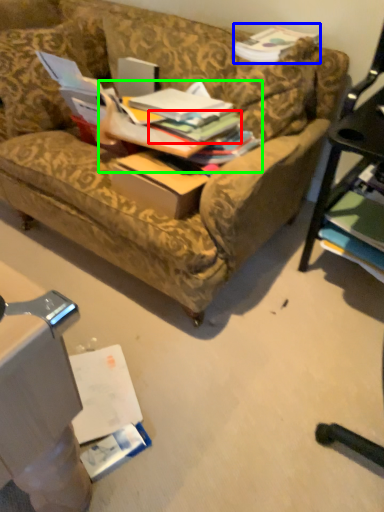
Question: Which object is positioned closest to book (highlighted by a red box)? Select from book (highlighted by a blue box) and book (highlighted by a green box).

Choices:
 (A) book
 (B) book

Answer: (B)